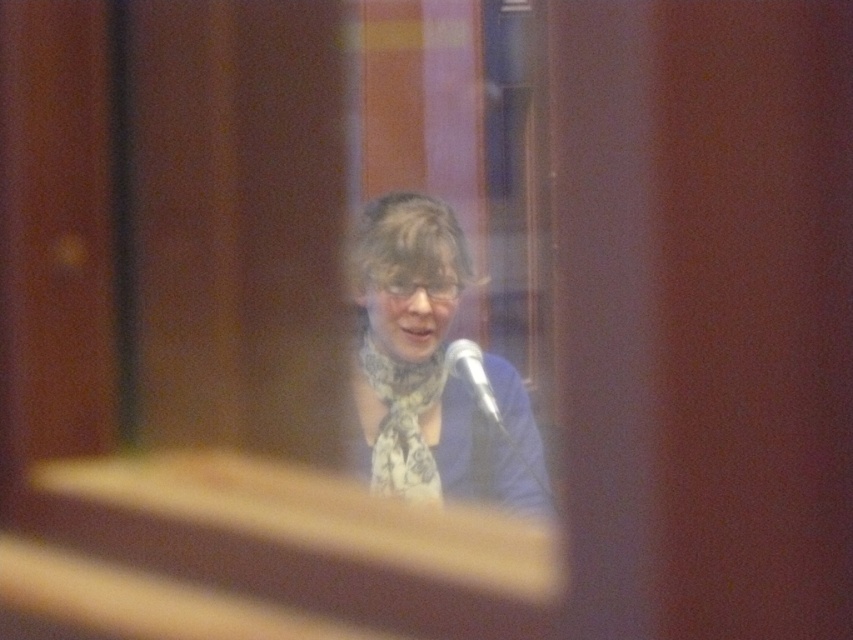
Question: Which object is closer to the camera taking this photo?

Choices:
 (A) silver metallic microphone at center
 (B) white printed scarf at center

Answer: (B)

Question: Observing the image, what is the correct spatial positioning of white printed scarf at center in reference to silver metallic microphone at center?

Choices:
 (A) right
 (B) left

Answer: (B)

Question: Which point is farther to the camera?

Choices:
 (A) (492, 422)
 (B) (498, 486)

Answer: (B)

Question: Which of the following is the farthest from the observer?

Choices:
 (A) silver metallic microphone at center
 (B) white printed scarf at center

Answer: (A)

Question: Does white printed scarf at center have a greater width compared to silver metallic microphone at center?

Choices:
 (A) yes
 (B) no

Answer: (A)

Question: Considering the relative positions of white printed scarf at center and silver metallic microphone at center in the image provided, where is white printed scarf at center located with respect to silver metallic microphone at center?

Choices:
 (A) above
 (B) below

Answer: (A)